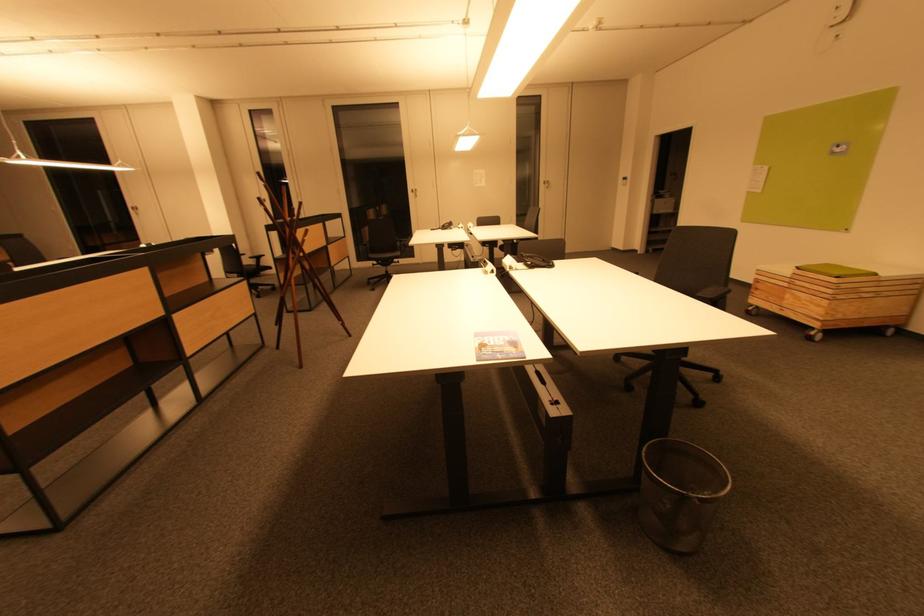
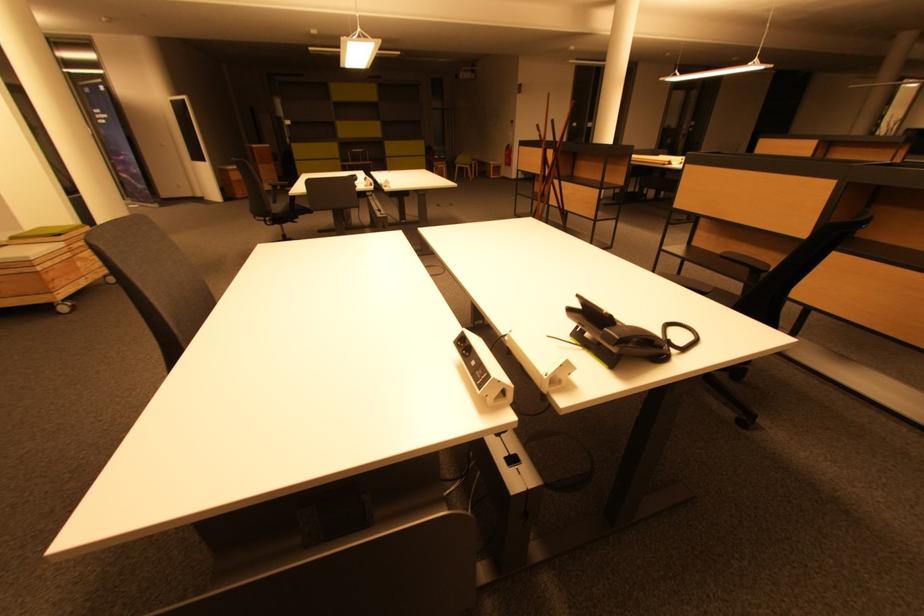
Where in the second image is the point corresponding to (793,299) from the first image?

(83, 265)